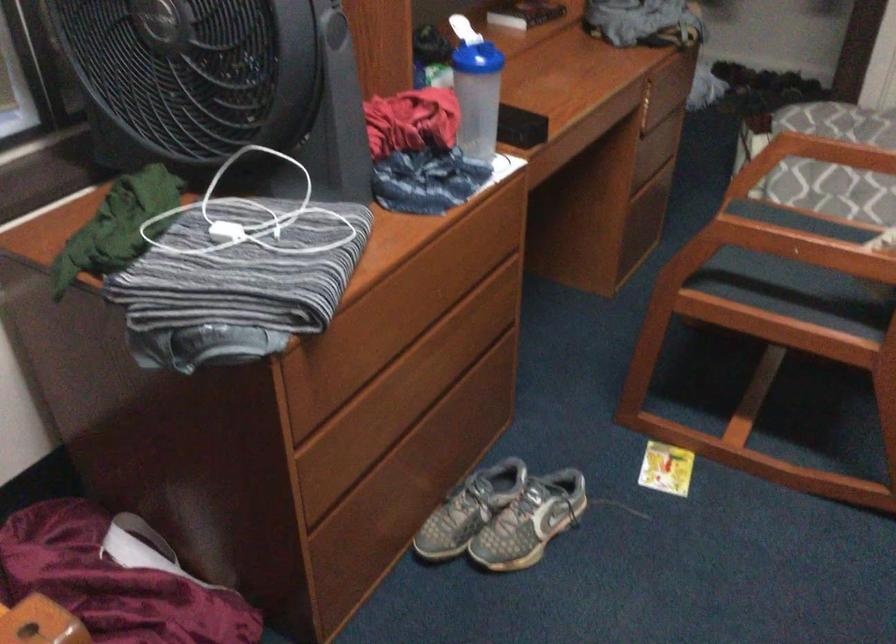
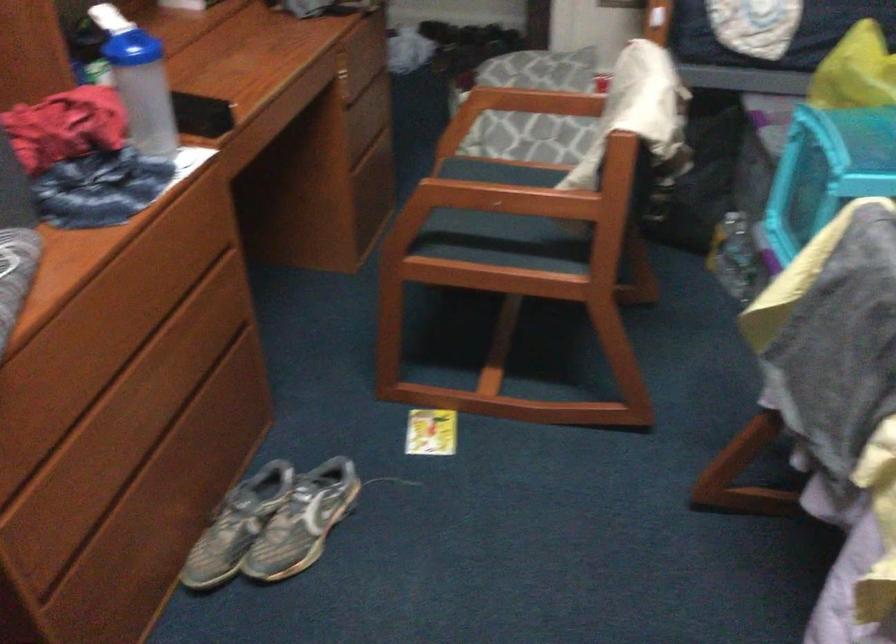
Question: The camera is either moving clockwise (left) or counter-clockwise (right) around the object. The first image is from the beginning of the video and the second image is from the end. Is the camera moving left or right when shooting the video?

Choices:
 (A) Left
 (B) Right

Answer: (A)